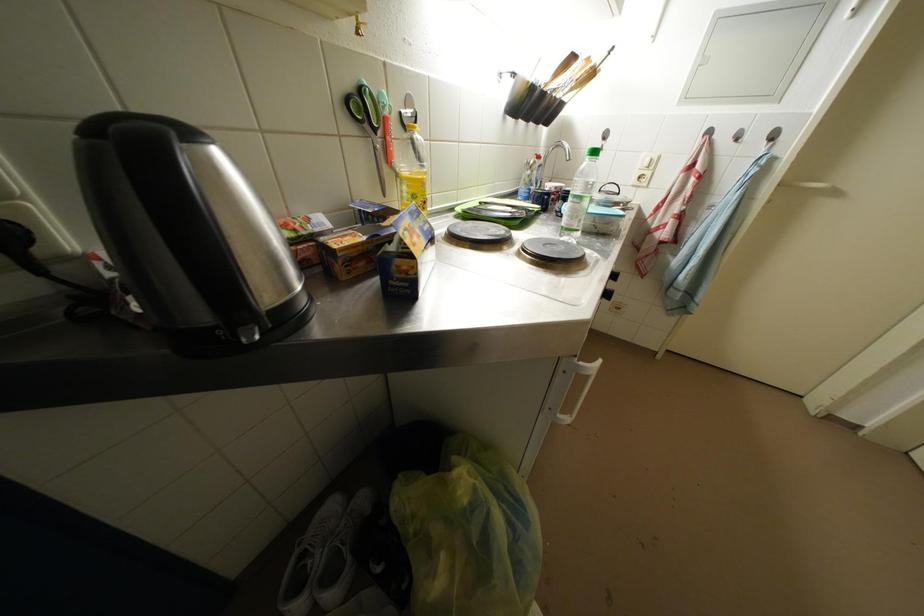
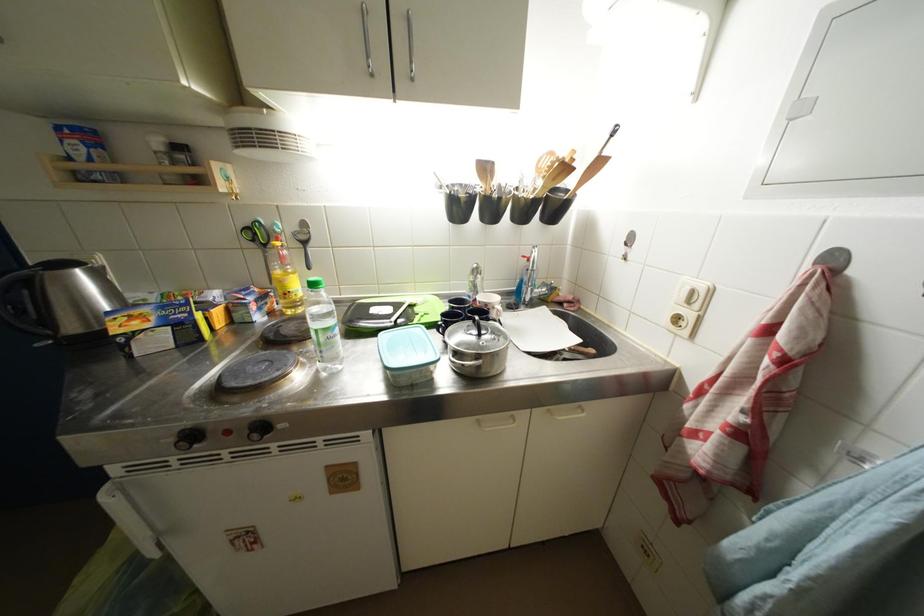
Where in the second image is the point corresponding to (382,135) from the first image?

(272, 249)